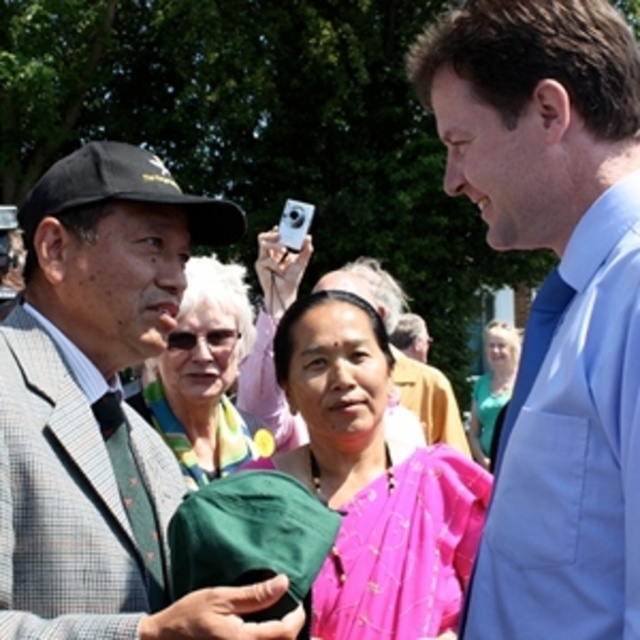
Does matte green scarf at center have a larger size compared to teal fabric dress at center?

Yes, matte green scarf at center is bigger than teal fabric dress at center.

Based on the photo, which of these two, matte green scarf at center or teal fabric dress at center, stands taller?

matte green scarf at center is taller.

Describe the element at coordinates (202, 376) in the screenshot. This screenshot has width=640, height=640. I see `matte green scarf at center` at that location.

This screenshot has height=640, width=640. Find the location of `matte green scarf at center`. matte green scarf at center is located at coordinates (202, 376).

Does blue satin tie at right have a larger size compared to pink silk saree at center?

Incorrect, blue satin tie at right is not larger than pink silk saree at center.

How much distance is there between blue satin tie at right and pink silk saree at center?

A distance of 7.47 feet exists between blue satin tie at right and pink silk saree at center.

The width and height of the screenshot is (640, 640). I want to click on blue satin tie at right, so click(x=554, y=300).

Is point (294, 454) behind point (484, 442)?

That is False.

What do you see at coordinates (372, 481) in the screenshot? The height and width of the screenshot is (640, 640). I see `pink silk saree at center` at bounding box center [372, 481].

Is point (332, 432) positioned before point (492, 387)?

Yes, it is in front of point (492, 387).

Locate an element on the screen. The width and height of the screenshot is (640, 640). pink silk saree at center is located at coordinates (372, 481).